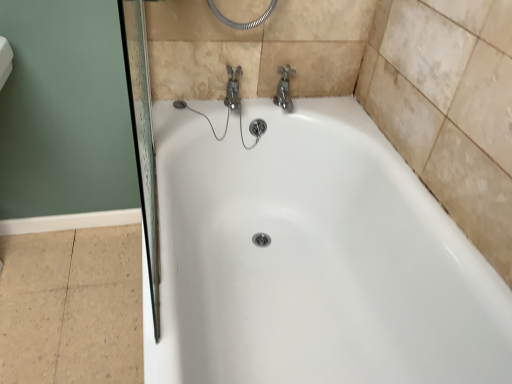
Question: Could you tell me if chrome metallic faucet at upper center is facing white glossy bathtub at center?

Choices:
 (A) yes
 (B) no

Answer: (B)

Question: Does chrome metallic faucet at upper center lie in front of white glossy bathtub at center?

Choices:
 (A) yes
 (B) no

Answer: (B)

Question: Does chrome metallic faucet at upper center contain white glossy bathtub at center?

Choices:
 (A) yes
 (B) no

Answer: (B)

Question: Is chrome metallic faucet at upper center taller than white glossy bathtub at center?

Choices:
 (A) no
 (B) yes

Answer: (A)

Question: From a real-world perspective, is chrome metallic faucet at upper center physically above white glossy bathtub at center?

Choices:
 (A) yes
 (B) no

Answer: (A)

Question: From the image's perspective, is chrome metallic faucet at upper center over white glossy bathtub at center?

Choices:
 (A) yes
 (B) no

Answer: (A)

Question: Is white glossy bathtub at center closer to camera compared to chrome metallic faucet at upper center?

Choices:
 (A) no
 (B) yes

Answer: (B)

Question: Could you tell me if white glossy bathtub at center is facing chrome metallic faucet at upper center?

Choices:
 (A) no
 (B) yes

Answer: (A)

Question: Can you confirm if white glossy bathtub at center is bigger than chrome metallic faucet at upper center?

Choices:
 (A) yes
 (B) no

Answer: (A)

Question: From a real-world perspective, is white glossy bathtub at center under chrome metallic faucet at upper center?

Choices:
 (A) no
 (B) yes

Answer: (B)

Question: Is white glossy bathtub at center positioned beyond the bounds of chrome metallic faucet at upper center?

Choices:
 (A) no
 (B) yes

Answer: (B)

Question: Is white glossy bathtub at center next to chrome metallic faucet at upper center?

Choices:
 (A) no
 (B) yes

Answer: (A)

Question: In terms of size, does chrome metallic faucet at upper center appear bigger or smaller than white glossy bathtub at center?

Choices:
 (A) big
 (B) small

Answer: (B)